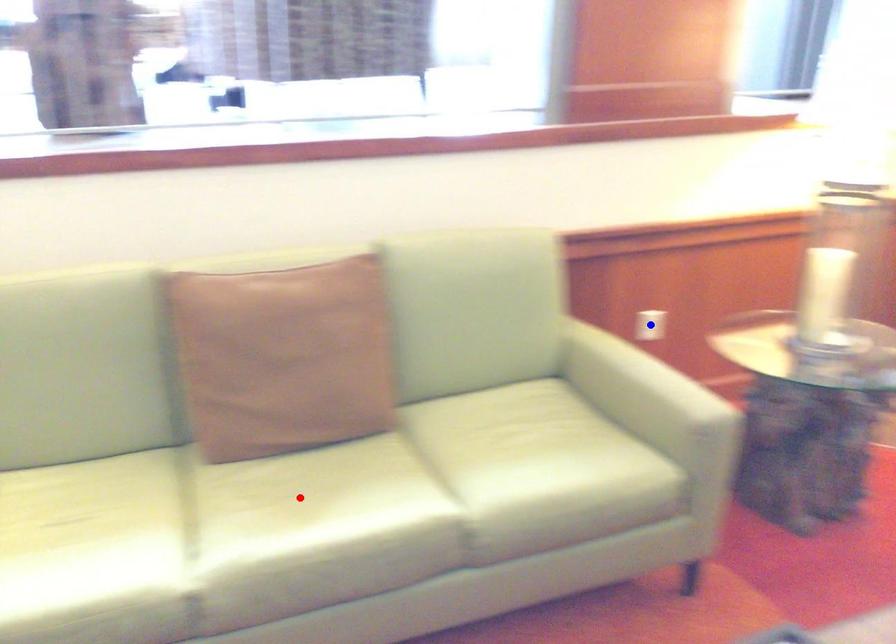
Question: Which of the two points in the image is closer to the camera?

Choices:
 (A) Blue point is closer.
 (B) Red point is closer.

Answer: (B)